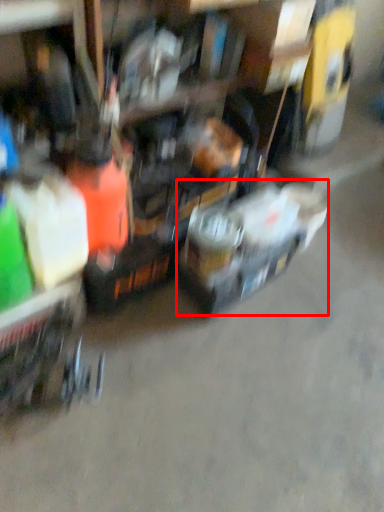
Question: Considering the relative positions of vehicle (annotated by the red box) and trolley in the image provided, where is vehicle (annotated by the red box) located with respect to the staircase?

Choices:
 (A) right
 (B) left

Answer: (A)